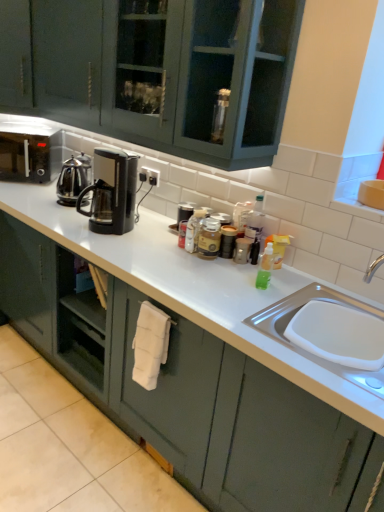
Identify the location of vacant area that lies between black plastic coffee maker at center, the first kitchen appliance viewed from the right, and metallic silver canister at center, which appears as the second appliance when viewed from the right. The width and height of the screenshot is (384, 512). (152, 227).